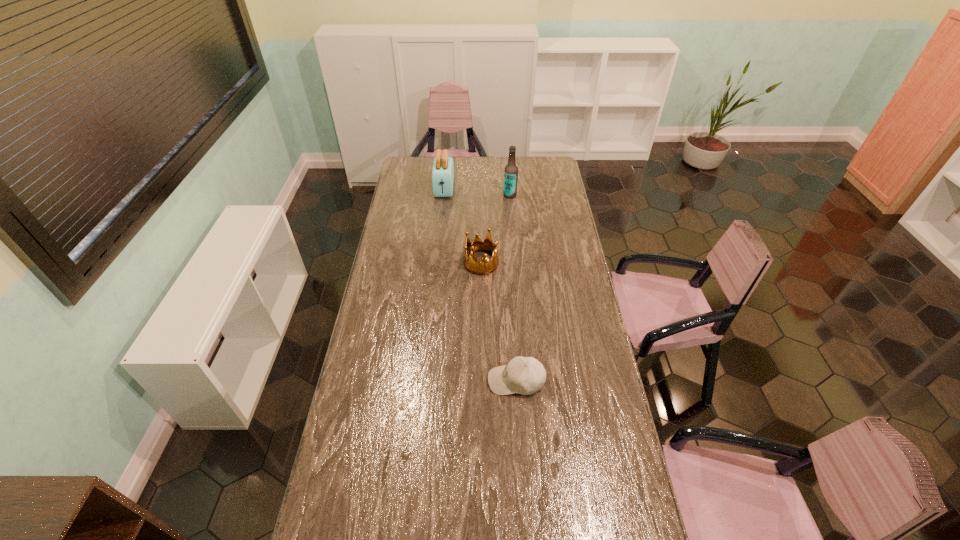
Where is `vacant area between the leftmost object and the beer bottle`? The height and width of the screenshot is (540, 960). vacant area between the leftmost object and the beer bottle is located at coordinates (477, 192).

You are a GUI agent. You are given a task and a screenshot of the screen. Output one action in this format:
    pyautogui.click(x=<x>, y=<y>)
    Task: Click on the vacant area that lies between the third shortest object and the tallest object
    The width and height of the screenshot is (960, 540).
    Given the screenshot: What is the action you would take?
    pyautogui.click(x=477, y=192)

This screenshot has height=540, width=960. Identify the location of free space between the baseball cap and the leftmost object. (480, 285).

You are a GUI agent. You are given a task and a screenshot of the screen. Output one action in this format:
    pyautogui.click(x=<x>, y=<y>)
    Task: Click on the vacant area that lies between the baseball cap and the second shortest object
    
    Given the screenshot: What is the action you would take?
    pyautogui.click(x=498, y=322)

Identify the location of vacant space in between the crown and the tallest object. (495, 229).

The width and height of the screenshot is (960, 540). I want to click on free space between the nearest object and the third farthest object, so click(498, 322).

Where is `empty space that is in between the tallest object and the baseball cap`? This screenshot has height=540, width=960. empty space that is in between the tallest object and the baseball cap is located at coordinates (513, 288).

The height and width of the screenshot is (540, 960). What are the coordinates of `blank region between the third tallest object and the tallest object` in the screenshot? It's located at click(x=495, y=229).

The height and width of the screenshot is (540, 960). Find the location of `vacant space in between the third farthest object and the tallest object`. vacant space in between the third farthest object and the tallest object is located at coordinates (495, 229).

The image size is (960, 540). I want to click on empty space that is in between the crown and the leftmost object, so click(x=463, y=226).